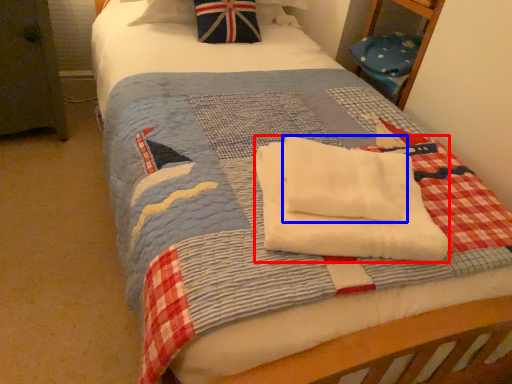
Question: Which of the following is the farthest to the observer, beach towel (highlighted by a red box) or beach towel (highlighted by a blue box)?

Choices:
 (A) beach towel
 (B) beach towel

Answer: (B)